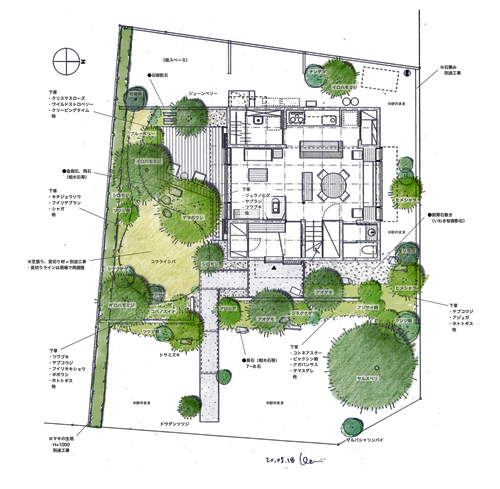
The height and width of the screenshot is (489, 500). What are the coordinates of `wall` in the screenshot? It's located at (423, 137).